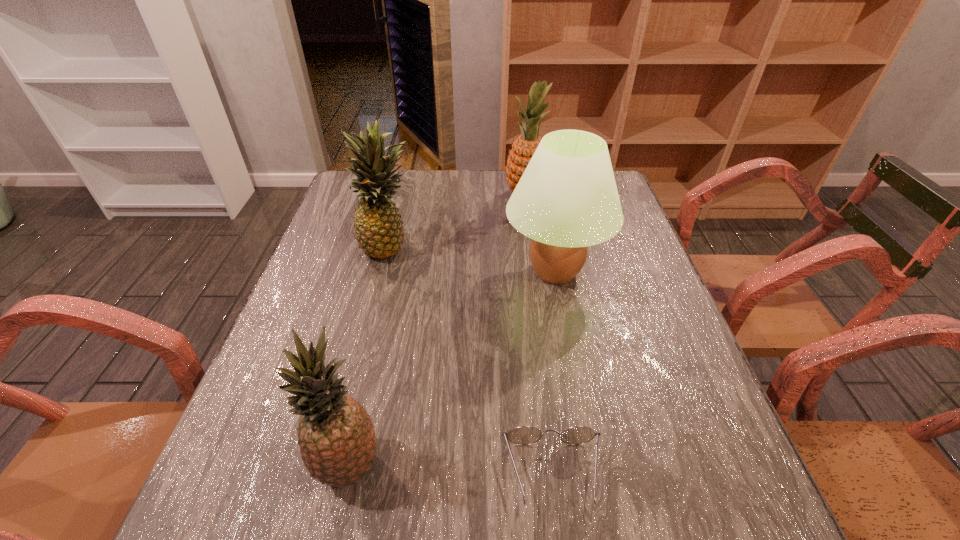
Identify the location of blank region between the lampshade and the second farthest pineapple. (472, 259).

This screenshot has height=540, width=960. I want to click on vacant point located between the second nearest pineapple and the farthest object, so click(458, 222).

Where is `object that stands as the third closest to the shortest object`? object that stands as the third closest to the shortest object is located at coordinates (379, 231).

Find the location of a particular element. This screenshot has width=960, height=540. object that stands as the fourth closest to the lampshade is located at coordinates (337, 440).

Locate an element on the screen. The height and width of the screenshot is (540, 960). the second closest pineapple relative to the farthest pineapple is located at coordinates (337, 440).

Point out which pineapple is positioned as the second nearest to the second nearest pineapple. Please provide its 2D coordinates. Your answer should be formatted as a tuple, i.e. [(x, y)], where the tuple contains the x and y coordinates of a point satisfying the conditions above.

[(337, 440)]

Locate an element on the screen. free space that satisfies the following two spatial constraints: 1. on the shade of the lampshade; 2. on the front-facing side of the shortest object is located at coordinates (594, 474).